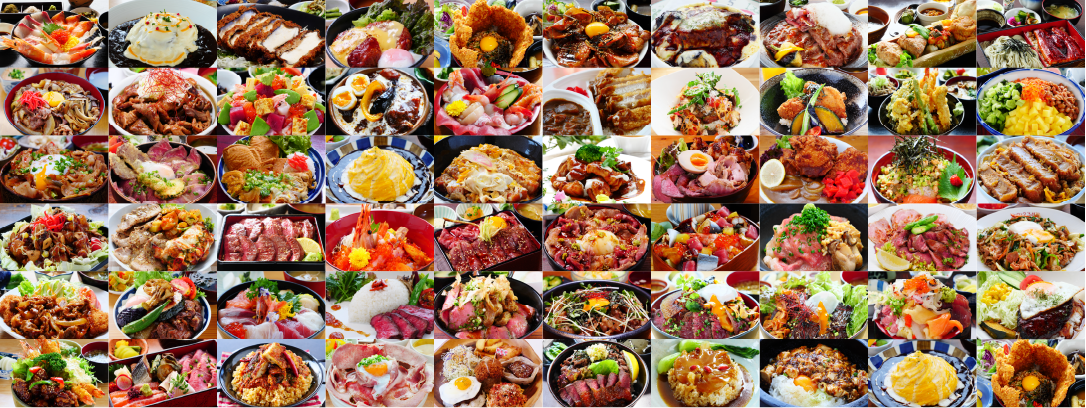
I want to click on pictures in the second from the bottom row, so click(x=50, y=304), click(x=152, y=304), click(x=252, y=306), click(x=395, y=308), click(x=479, y=305), click(x=595, y=309), click(x=693, y=311), click(x=804, y=312), click(x=904, y=314), click(x=1023, y=315).